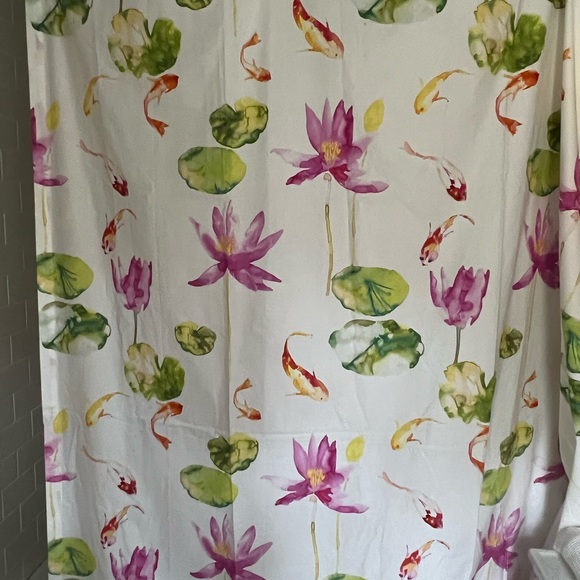
The height and width of the screenshot is (580, 580). Identify the location of wrinkles in curtain. (227, 427), (264, 432), (227, 287).